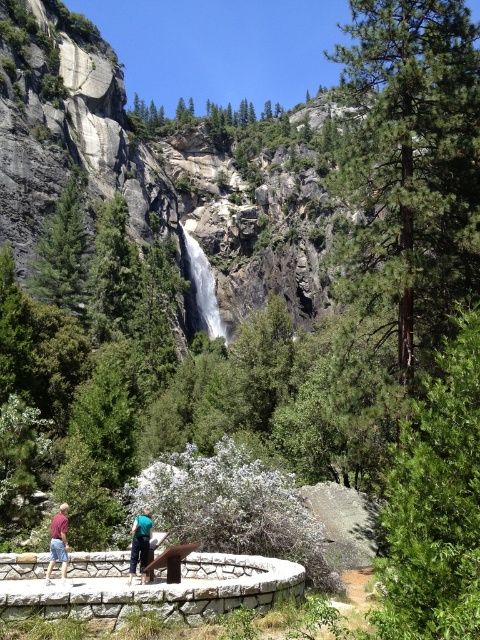
Who is positioned more to the left, white smooth waterfall at center or maroon fabric shirt at lower left?

maroon fabric shirt at lower left is more to the left.

Which is in front, point (204, 257) or point (63, 532)?

Point (63, 532)

You are a GUI agent. You are given a task and a screenshot of the screen. Output one action in this format:
    pyautogui.click(x=<x>, y=<y>)
    Task: Click on the white smooth waterfall at center
    
    Given the screenshot: What is the action you would take?
    pyautogui.click(x=204, y=285)

Which of these two, green fabric shirt at center or maroon fabric shirt at lower left, stands shorter?

Standing shorter between the two is green fabric shirt at center.

Is green fabric shirt at center thinner than maroon fabric shirt at lower left?

Yes.

Does point (143, 516) come closer to viewer compared to point (57, 531)?

No.

You are a GUI agent. You are given a task and a screenshot of the screen. Output one action in this format:
    pyautogui.click(x=<x>, y=<y>)
    Task: Click on the green fabric shirt at center
    Image resolution: width=480 pixels, height=640 pixels.
    Given the screenshot: What is the action you would take?
    pyautogui.click(x=140, y=544)

The height and width of the screenshot is (640, 480). What do you see at coordinates (204, 285) in the screenshot?
I see `white smooth waterfall at center` at bounding box center [204, 285].

Is white smooth waterfall at center wider than green fabric shirt at center?

Yes, white smooth waterfall at center is wider than green fabric shirt at center.

Who is more distant from viewer, (213, 324) or (151, 532)?

Positioned behind is point (213, 324).

I want to click on white smooth waterfall at center, so click(204, 285).